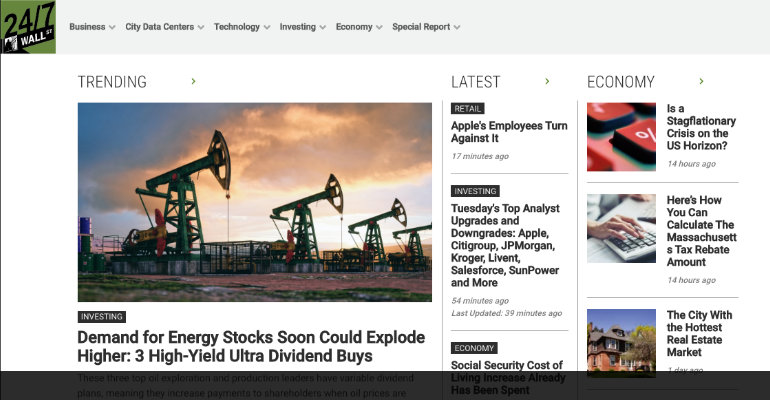
Identify the location of keyboard. This screenshot has width=770, height=400. (631, 248).